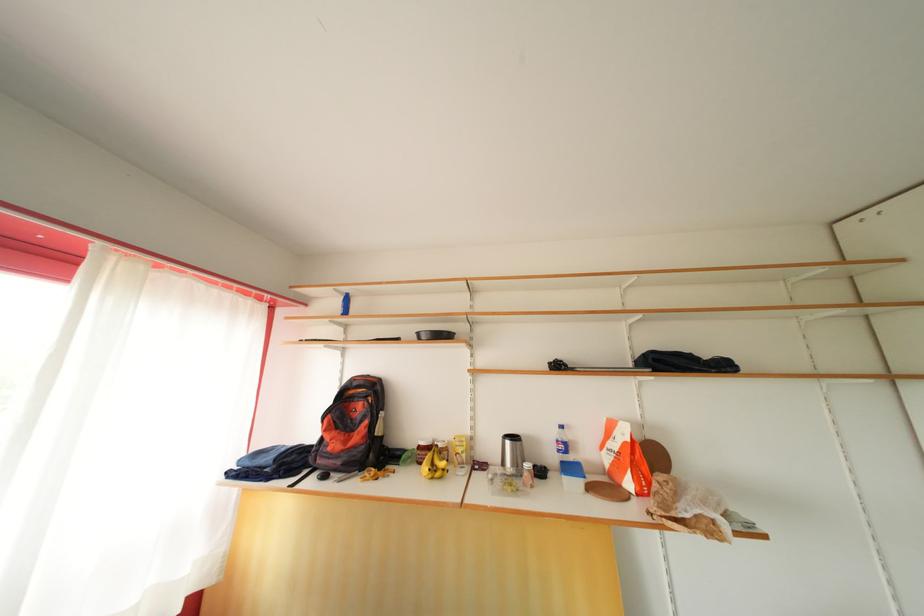
Find where to lift the blue-lidded container. Please return your answer as a coordinate pair (x, y).

(572, 475)